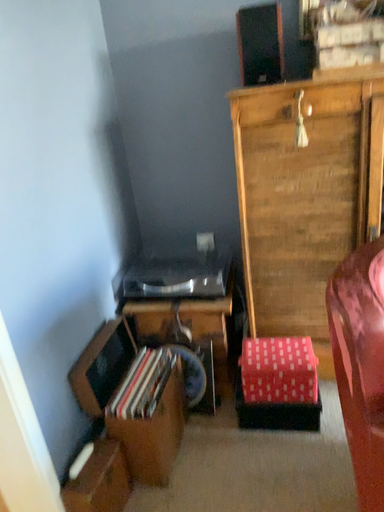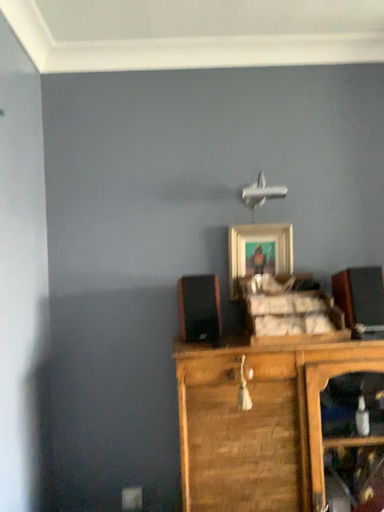
Question: How did the camera likely rotate when shooting the video?

Choices:
 (A) rotated upward
 (B) rotated downward

Answer: (A)